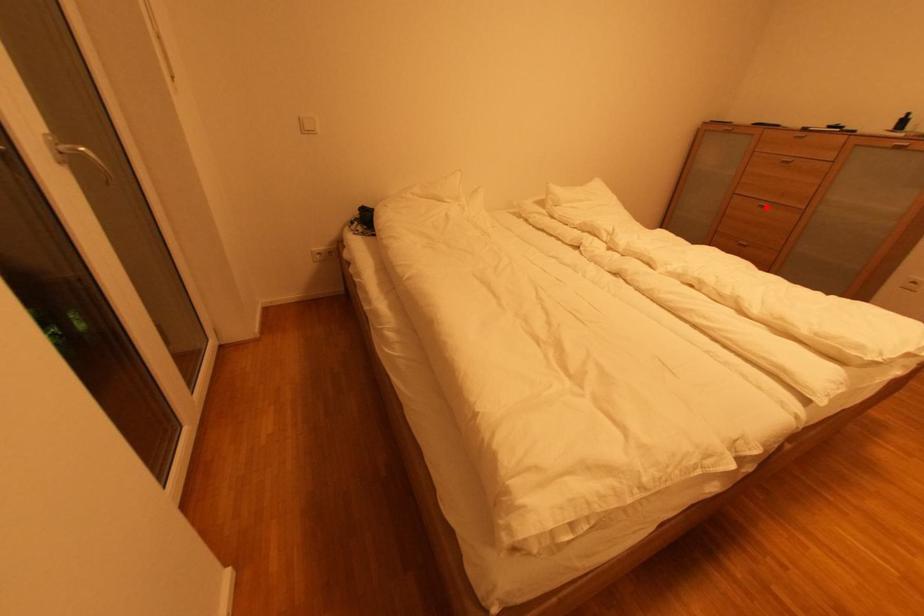
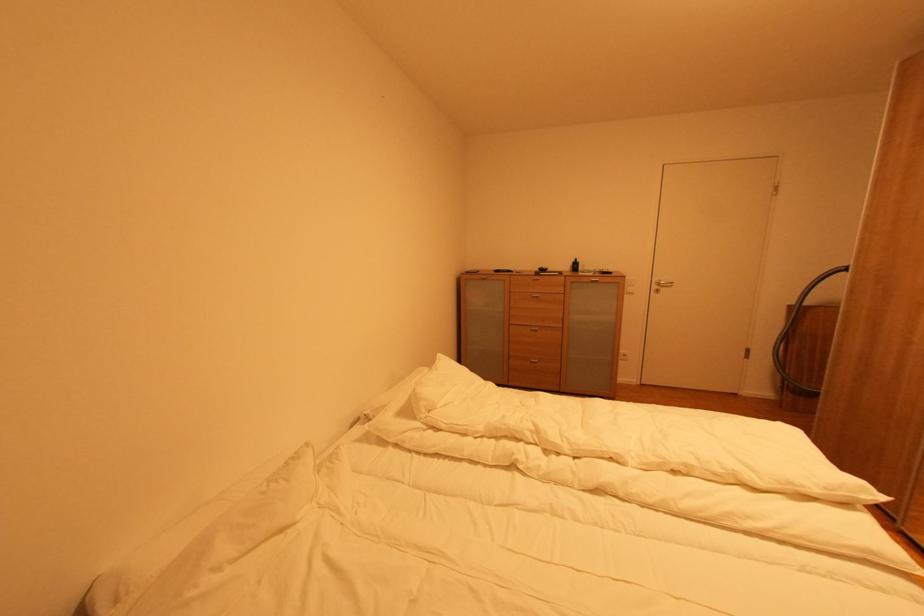
Question: I am providing you with two images of the same scene from different viewpoints. A red point is marked on the first image. Is the red point's position out of view in image 2?

Choices:
 (A) Yes
 (B) No

Answer: (B)